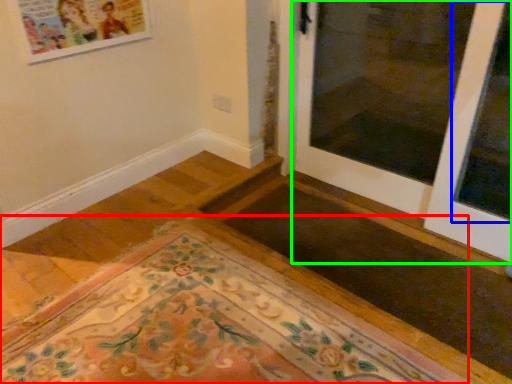
Question: Based on their relative distances, which object is farther from mat (highlighted by a red box)? Choose from window (highlighted by a blue box) and door (highlighted by a green box).

Choices:
 (A) window
 (B) door

Answer: (A)